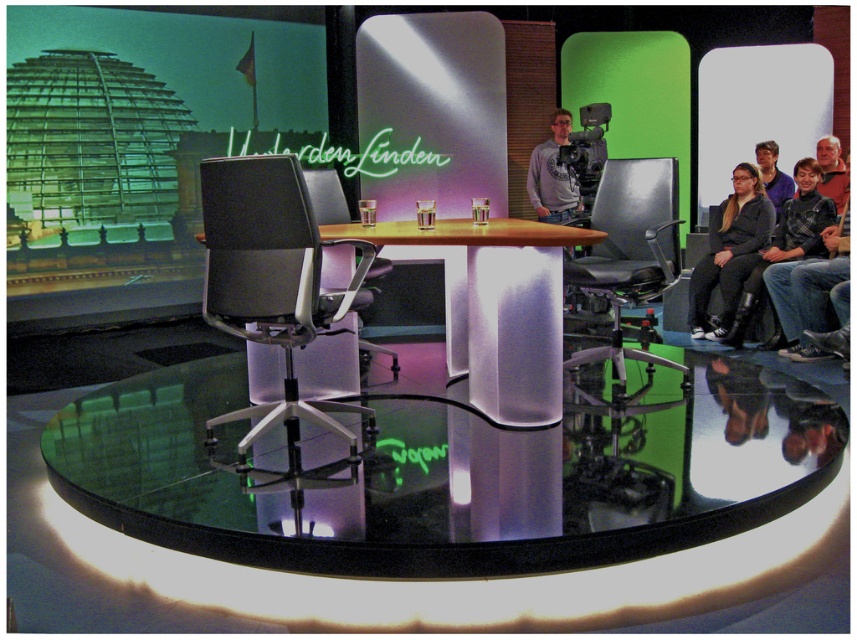
Question: Which point is farther to the camera?

Choices:
 (A) (243, 218)
 (B) (812, 227)
 (C) (327, 196)

Answer: (B)

Question: Does transparent glass table at center appear under matte black chair at center?

Choices:
 (A) no
 (B) yes

Answer: (B)

Question: Is transparent glass round table at center smaller than black leather jacket at right?

Choices:
 (A) yes
 (B) no

Answer: (B)

Question: Which object is closer to the camera taking this photo?

Choices:
 (A) transparent glass table at center
 (B) matte black chair at center
 (C) gray cotton shirt at center
 (D) black leather jacket at right

Answer: (A)

Question: Which object is positioned closest to the black leather jacket at right?

Choices:
 (A) transparent glass table at center
 (B) gray cotton shirt at center
 (C) green matte glass dome at upper left
 (D) matte black swivel chair at center

Answer: (B)

Question: Observing the image, what is the correct spatial positioning of matte black swivel chair at center in reference to gray cotton shirt at center?

Choices:
 (A) right
 (B) left

Answer: (B)